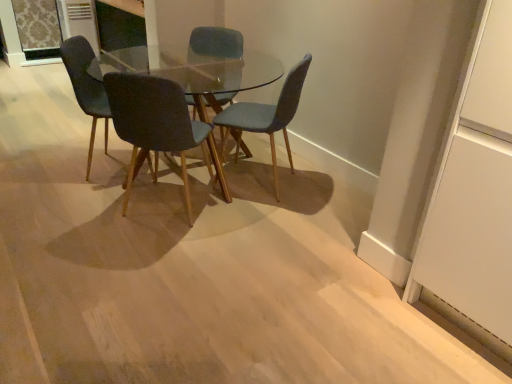
This screenshot has width=512, height=384. I want to click on vacant region in front of dark gray fabric chair at center, which appears as the third chair when viewed from the right, so click(x=152, y=251).